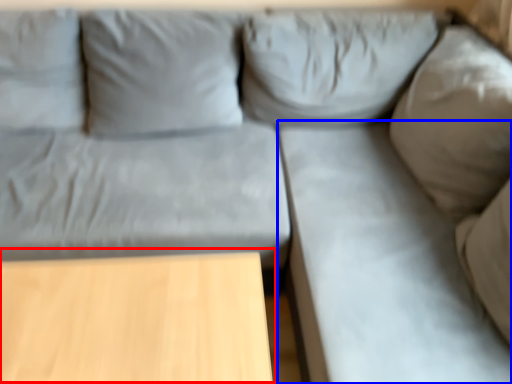
Question: Among these objects, which one is nearest to the camera, table (highlighted by a red box) or sheet (highlighted by a blue box)?

Choices:
 (A) table
 (B) sheet

Answer: (B)